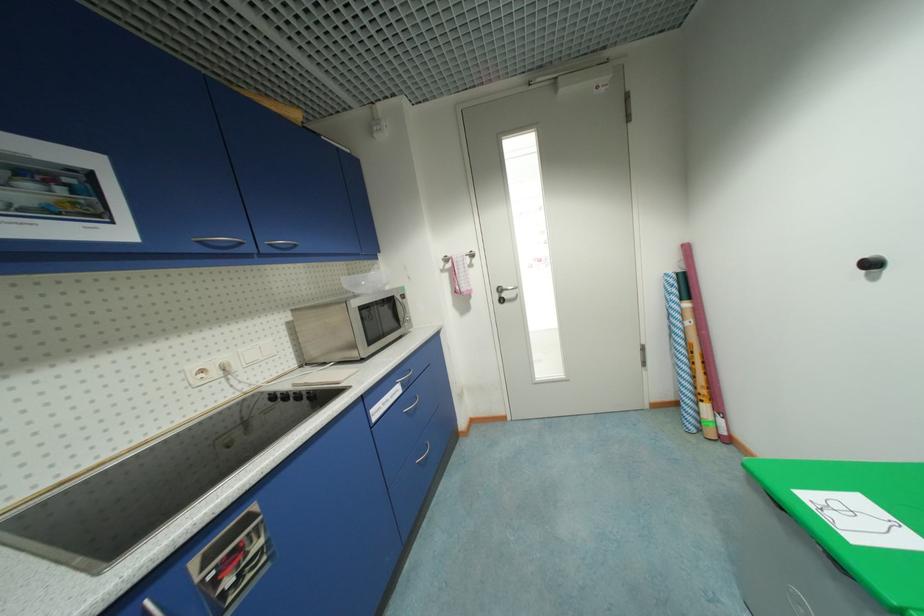
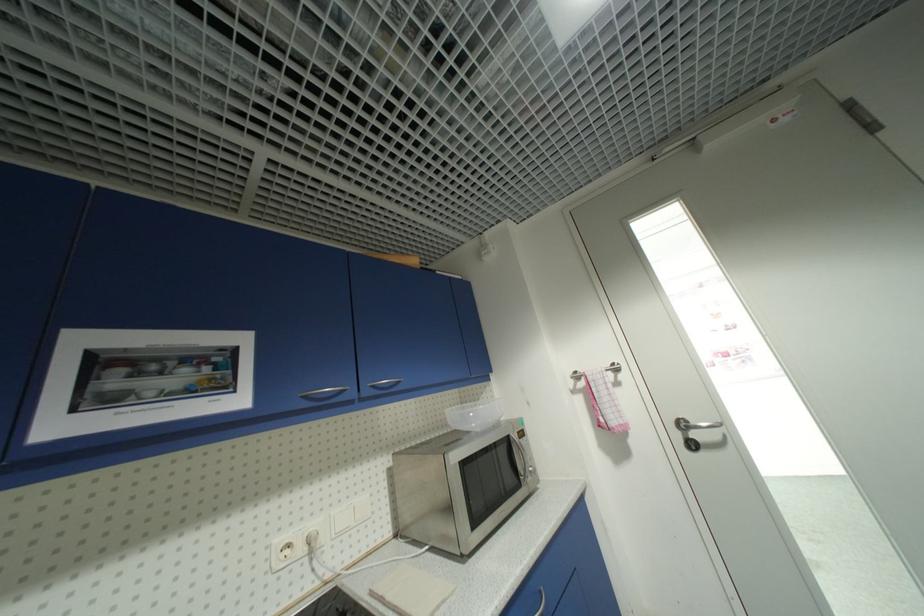
Locate, in the second image, the point that corresponds to (473,254) in the first image.

(614, 367)